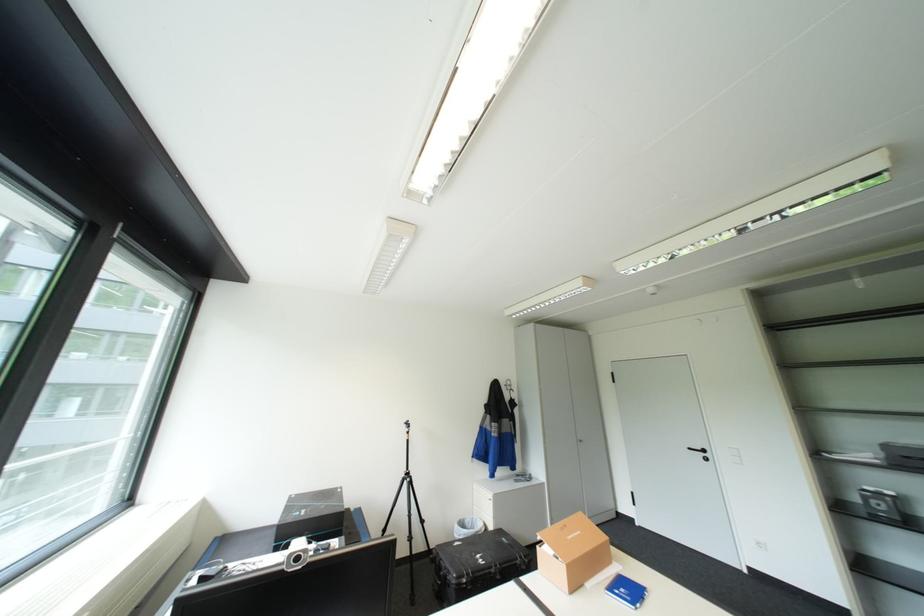
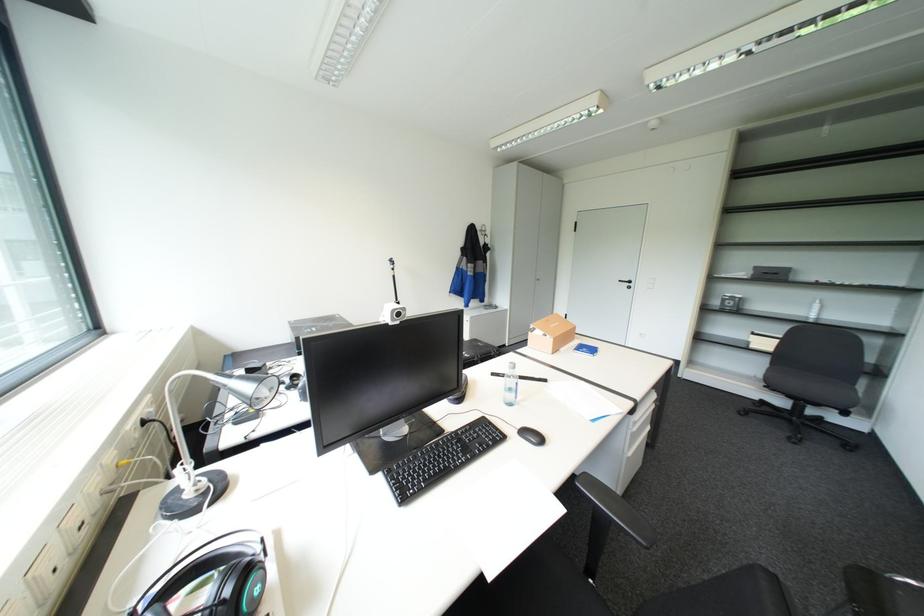
Question: The first image is from the beginning of the video and the second image is from the end. How did the camera likely rotate when shooting the video?

Choices:
 (A) Left
 (B) Right
 (C) Up
 (D) Down

Answer: (D)